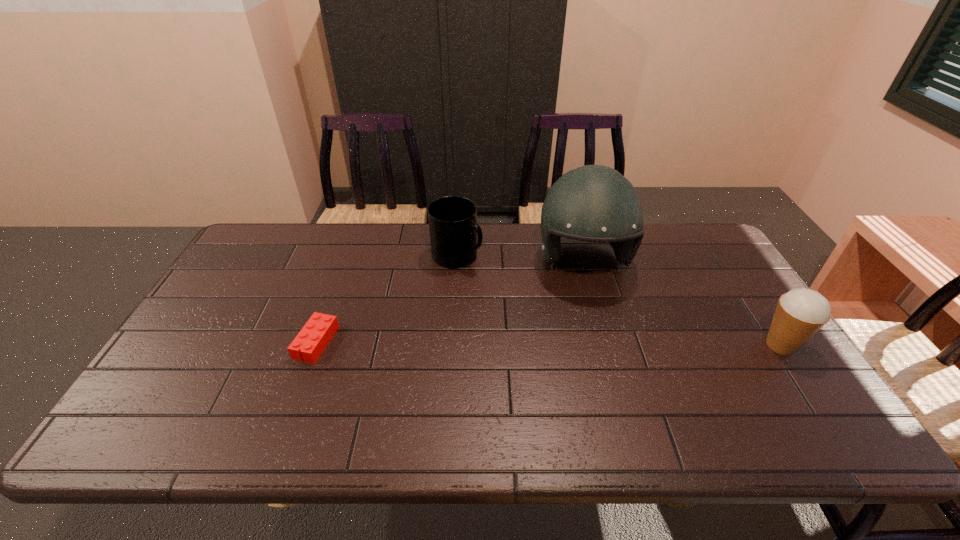
You are a GUI agent. You are given a task and a screenshot of the screen. Output one action in this format:
    pyautogui.click(x=<x>, y=<y>)
    Task: Click on the free spot at the right edge of the desktop
    This screenshot has width=960, height=540.
    Given the screenshot: What is the action you would take?
    click(780, 370)

The image size is (960, 540). In order to click on vacant space in between the rightmost object and the second object from left to right in this screenshot , I will do `click(618, 301)`.

Where is `free space between the rightmost object and the leftmost object`? The width and height of the screenshot is (960, 540). free space between the rightmost object and the leftmost object is located at coordinates (548, 344).

Image resolution: width=960 pixels, height=540 pixels. What are the coordinates of `vacant space in between the leftmost object and the icecream` in the screenshot? It's located at (548, 344).

Find the location of a particular element. This screenshot has width=960, height=540. vacant area that lies between the Lego and the second object from left to right is located at coordinates (387, 299).

The width and height of the screenshot is (960, 540). What are the coordinates of `unoccupied position between the tallest object and the icecream` in the screenshot? It's located at (682, 303).

You are a GUI agent. You are given a task and a screenshot of the screen. Output one action in this format:
    pyautogui.click(x=<x>, y=<y>)
    Task: Click on the vacant area between the icecream and the football helmet
    The width and height of the screenshot is (960, 540).
    Given the screenshot: What is the action you would take?
    pos(682,303)

Where is `unoccupied area between the icecream and the third object from right to left`? This screenshot has height=540, width=960. unoccupied area between the icecream and the third object from right to left is located at coordinates (618, 301).

This screenshot has width=960, height=540. In order to click on free area in between the third object from left to right and the leftmost object in this screenshot , I will do `click(449, 302)`.

At what (x,y) coordinates should I click in order to perform the action: click on vacant area between the icecream and the tallest object. Please return your answer as a coordinate pair (x, y). Looking at the image, I should click on (682, 303).